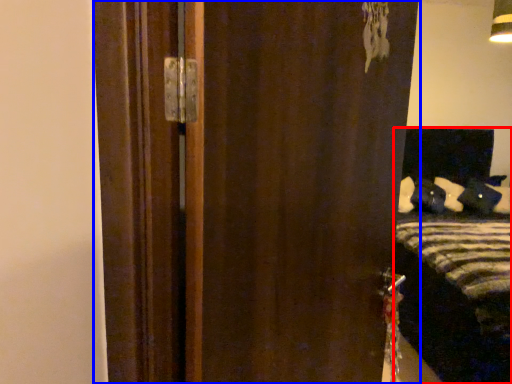
Question: Which point is closer to the camera, bed (highlighted by a red box) or door (highlighted by a blue box)?

Choices:
 (A) bed
 (B) door

Answer: (B)